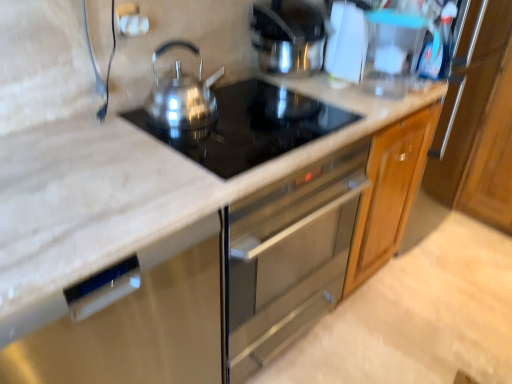
Locate an element on the screen. The image size is (512, 384). free region under satin silver kettle at upper center, the 1th kitchen appliance in the back-to-front sequence (from a real-world perspective) is located at coordinates (291, 79).